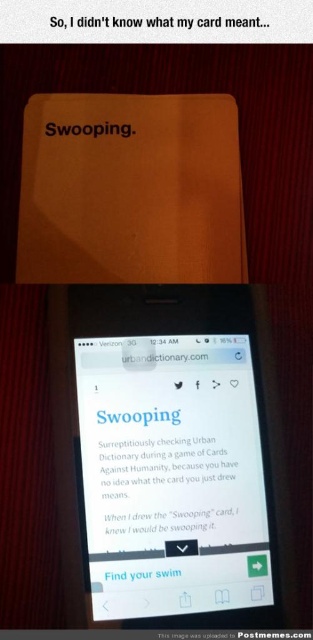
What is located at the point with coordinates (140, 573)?

The point at (140, 573) corresponds to white matte text at center.

You are organizing a desk and see two white papers. One is labeled as the white paper at center and the other as the white paper at upper center. Which one is positioned higher on the desk?

The white paper at center is positioned higher on the desk than the white paper at upper center.